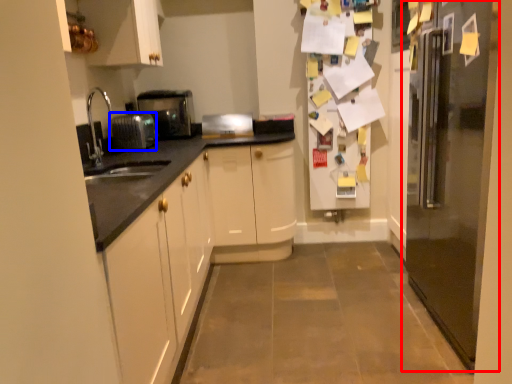
Question: Which point is further to the camera, refrigerator (highlighted by a red box) or appliance (highlighted by a blue box)?

Choices:
 (A) refrigerator
 (B) appliance

Answer: (B)